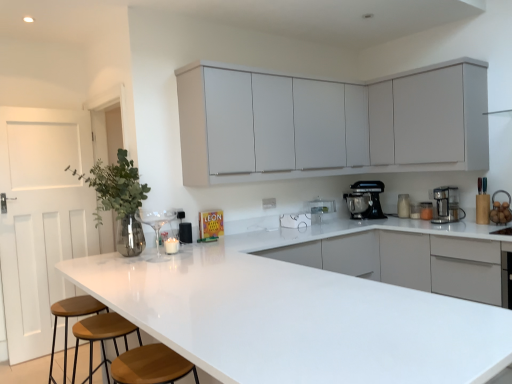
Question: In the image, is brown leather stool at lower left, acting as the 2th bar stool starting from the front, positioned in front of or behind white matte cabinet at upper center, marked as the second cabinetry in a right-to-left arrangement?

Choices:
 (A) front
 (B) behind

Answer: (B)

Question: From a real-world perspective, is brown leather stool at lower left, acting as the 2th bar stool starting from the front, physically located above or below white matte cabinet at upper center, which ranks as the 1th cabinetry in left-to-right order?

Choices:
 (A) above
 (B) below

Answer: (B)

Question: Which object is positioned farthest from the matte black coffee maker at right, which ranks as the second appliance in back-to-front order?

Choices:
 (A) brown wooden stool at lower left, the 1th bar stool positioned from the front
 (B) silver metallic vase at left
 (C) metallic silver coffee maker at right, which is the second home appliance in left-to-right order
 (D) white matte cabinet at upper center, which ranks as the 1th cabinetry in left-to-right order
 (E) black matte stand mixer at right, placed as the 1th home appliance when sorted from left to right

Answer: (A)

Question: Which object is the farthest from the brown leather stool at lower left, which is counted as the first bar stool, starting from the back?

Choices:
 (A) white glossy countertop at center
 (B) white glossy milk bottle at right, which appears as the first appliance when viewed from the left
 (C) silver metallic vase at left
 (D) matte black coffee maker at right, which ranks as the second appliance in back-to-front order
 (E) brown wooden stool at lower left, positioned as the second bar stool in back-to-front order

Answer: (D)